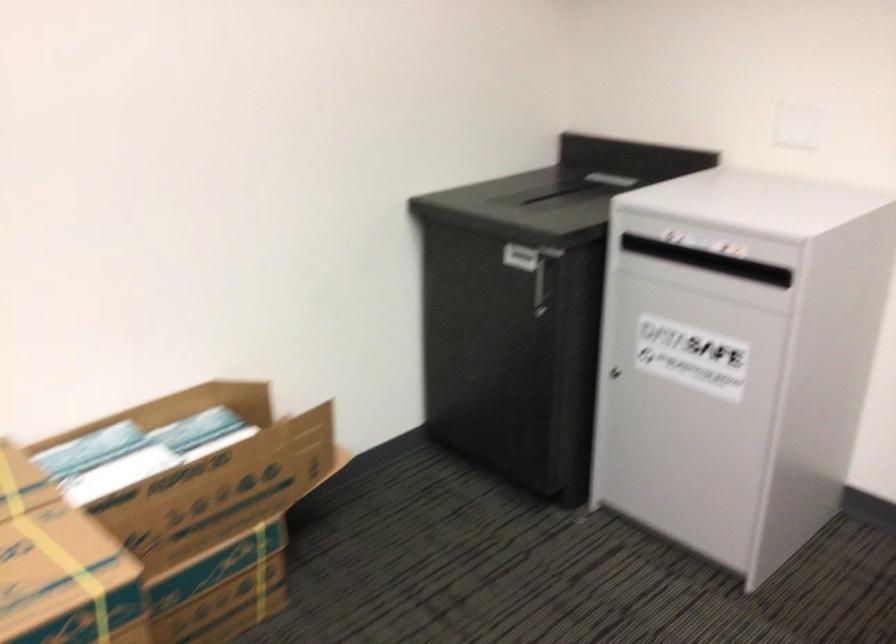
Locate an element on the screen. cardboard box flap is located at coordinates (211, 402).